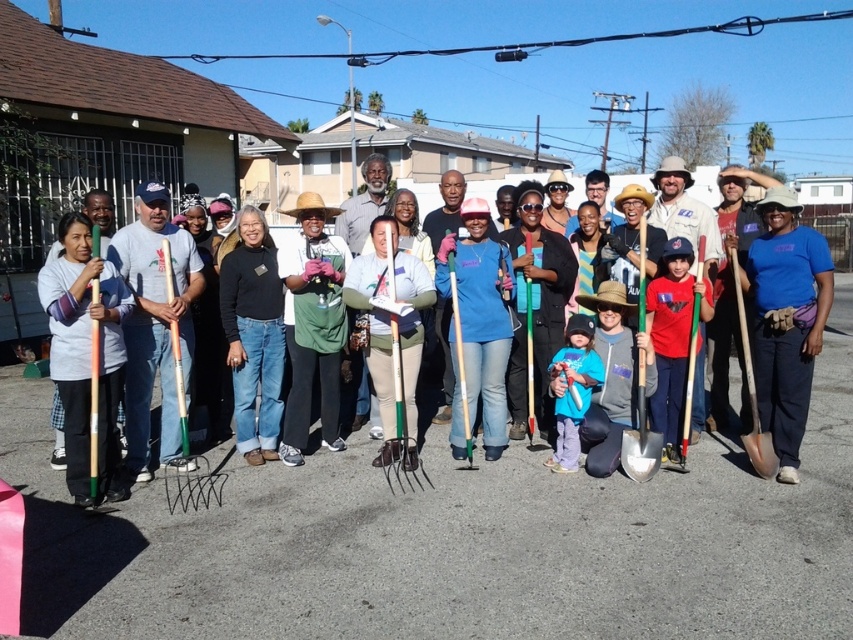
Can you confirm if blue fabric shirt at center is bigger than green plastic rake at center?

Correct, blue fabric shirt at center is larger in size than green plastic rake at center.

Locate an element on the screen. The height and width of the screenshot is (640, 853). blue fabric shirt at center is located at coordinates (786, 320).

What are the coordinates of `blue fabric shirt at center` in the screenshot? It's located at (786, 320).

Image resolution: width=853 pixels, height=640 pixels. I want to click on blue fabric shirt at center, so click(786, 320).

The height and width of the screenshot is (640, 853). What do you see at coordinates (477, 326) in the screenshot?
I see `blue matte shirt at center` at bounding box center [477, 326].

Between blue matte shirt at center and blue cotton shirt at center, which one appears on the left side from the viewer's perspective?

blue matte shirt at center

Measure the distance between point (468, 428) and camera.

They are 17.18 feet apart.

I want to click on blue matte shirt at center, so click(x=477, y=326).

Image resolution: width=853 pixels, height=640 pixels. In order to click on blue matte shirt at center in this screenshot , I will do `click(477, 326)`.

Which is behind, point (471, 422) or point (262, 260)?

The point (471, 422) is behind.

The image size is (853, 640). What are the coordinates of `blue matte shirt at center` in the screenshot? It's located at (477, 326).